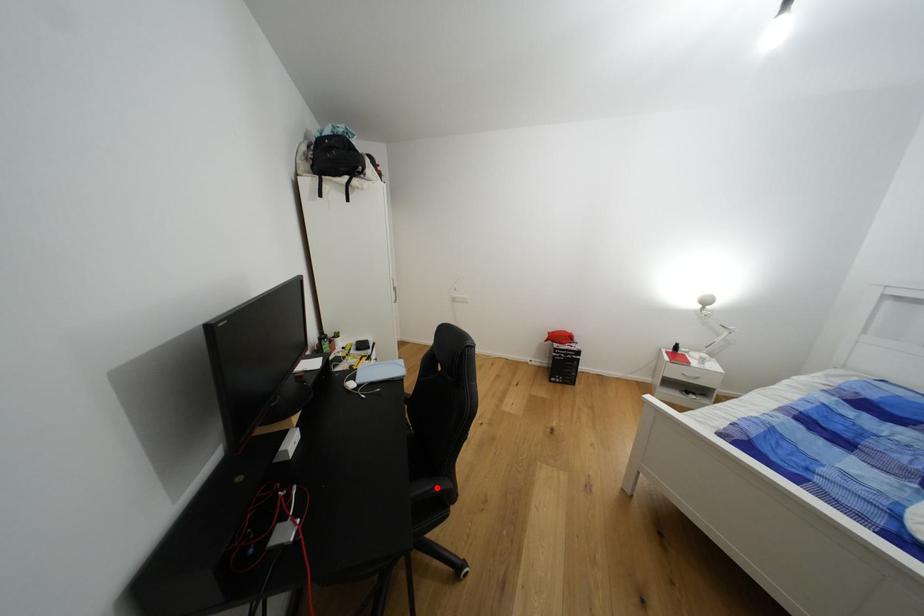
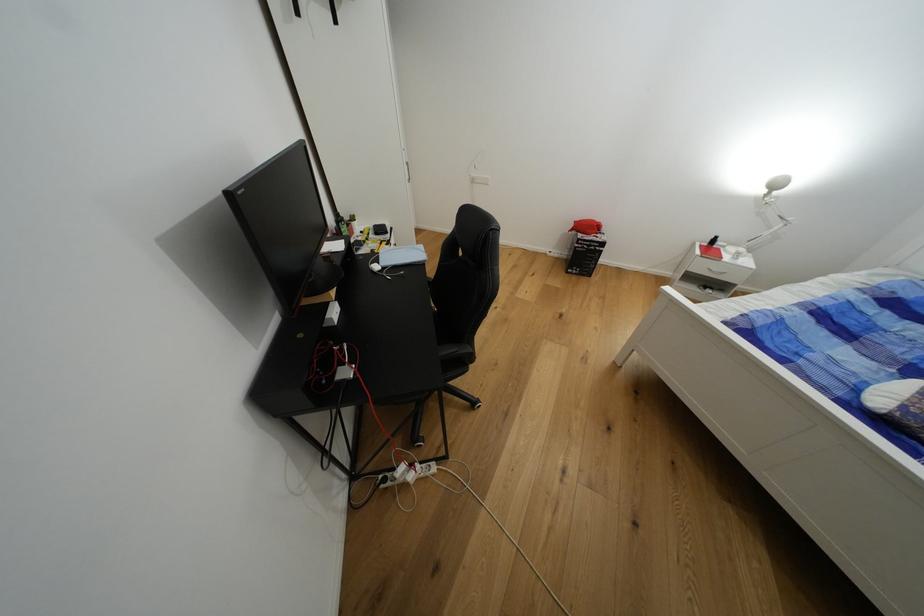
Locate, in the second image, the point that corresponds to the highlighted location in the first image.

(460, 351)